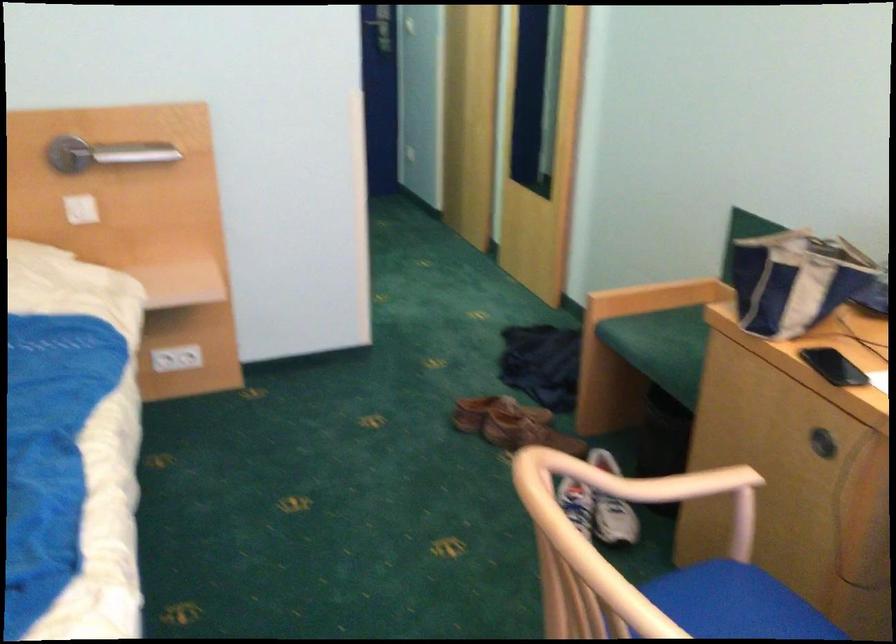
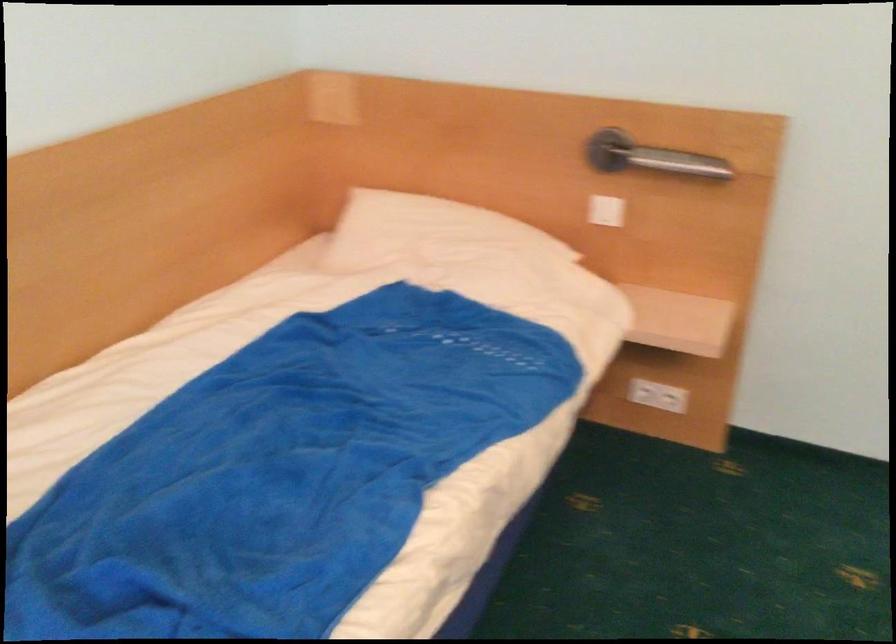
Question: The camera is either moving clockwise (left) or counter-clockwise (right) around the object. The first image is from the beginning of the video and the second image is from the end. Is the camera moving left or right when shooting the video?

Choices:
 (A) Left
 (B) Right

Answer: (B)